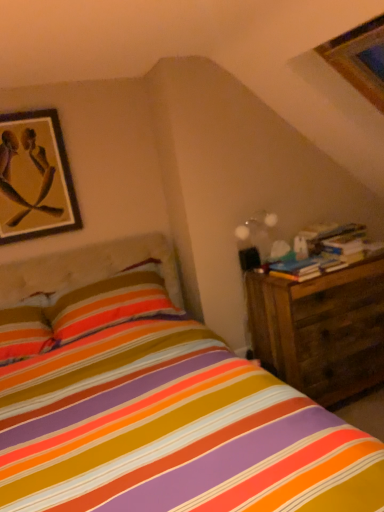
Question: From a real-world perspective, is translucent glass globe at upper right positioned above or below wooden nightstand at right?

Choices:
 (A) above
 (B) below

Answer: (A)

Question: Considering the positions of translucent glass globe at upper right and wooden nightstand at right in the image, is translucent glass globe at upper right bigger or smaller than wooden nightstand at right?

Choices:
 (A) big
 (B) small

Answer: (B)

Question: Estimate the real-world distances between objects in this image. Which object is farther from the wooden nightstand at right?

Choices:
 (A) wooden framed artwork at upper left
 (B) translucent glass globe at upper right

Answer: (A)

Question: Estimate the real-world distances between objects in this image. Which object is farther from the wooden framed artwork at upper left?

Choices:
 (A) translucent glass globe at upper right
 (B) wooden nightstand at right

Answer: (B)